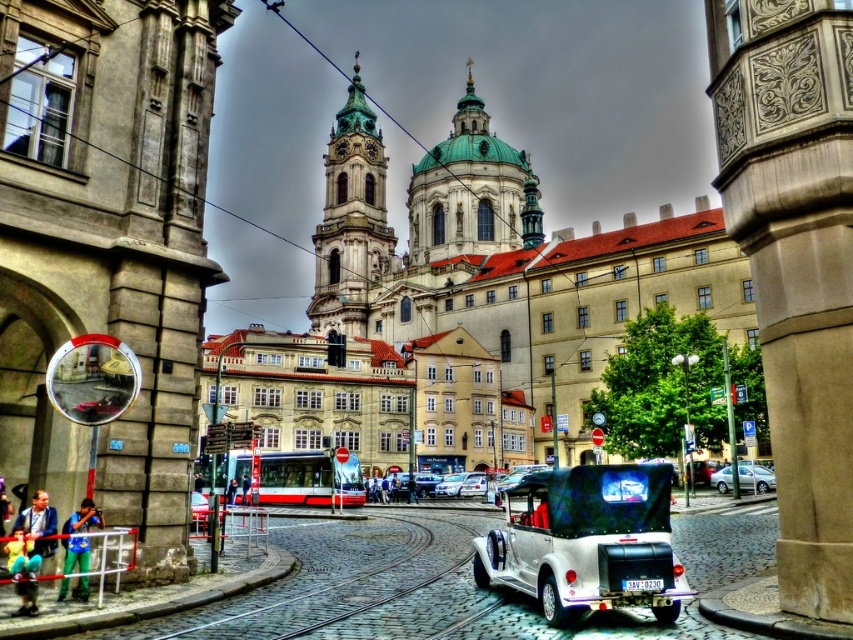
You are a tourist in Prague and want to take a photo of the St. Nicholas Church. You have two cars in front of you, the metallic silver car at center and the silver metallic sedan at lower right. Which car should you move to get a clearer view of the church?

You should move the metallic silver car at center because it is larger and closer to you, blocking more of the view compared to the smaller silver metallic sedan at lower right.

You are a pedestrian standing on the cobblestone street in front of the St. Nicholas Church. You see a metallic silver car at center and a silver metallic sedan at lower right. Which vehicle is positioned higher in the image?

The metallic silver car at center is positioned higher than the silver metallic sedan at lower right in the image.